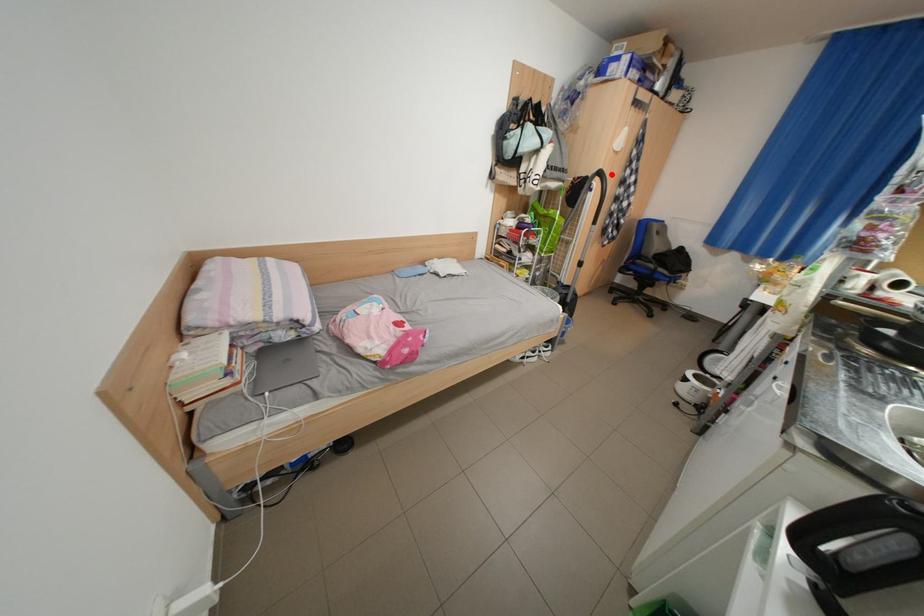
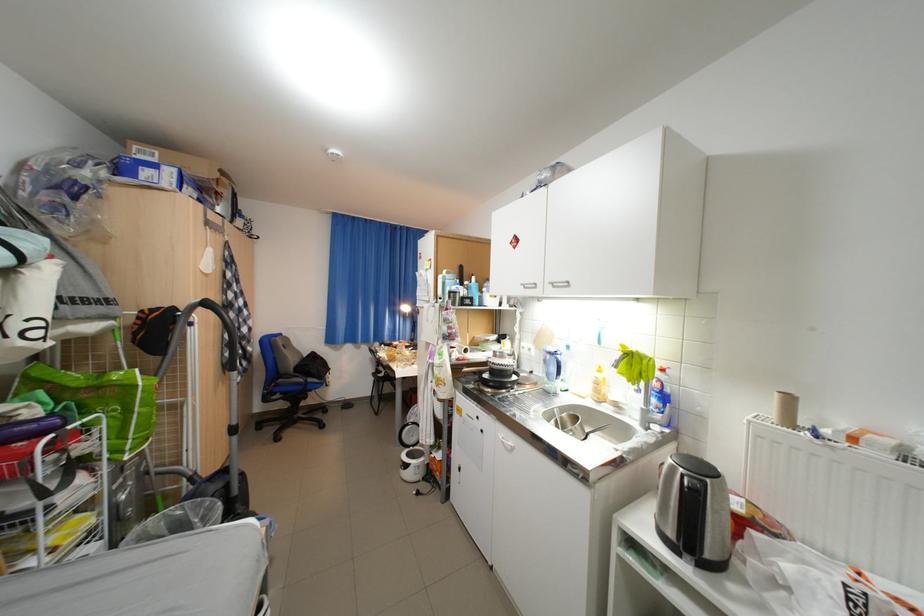
Question: I am providing you with two images of the same scene from different viewpoints. Image1 has a red point marked. In image2, the corresponding 3D location appears at what relative position? Reply with the corresponding letter.

Choices:
 (A) Closer
 (B) Farther

Answer: (B)